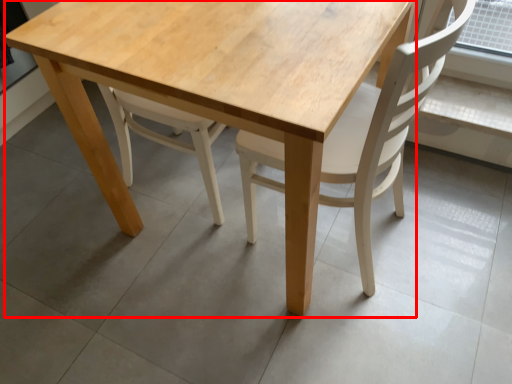
Question: From the image's perspective, what is the correct spatial positioning of round table (annotated by the red box) in reference to chair?

Choices:
 (A) below
 (B) above

Answer: (B)